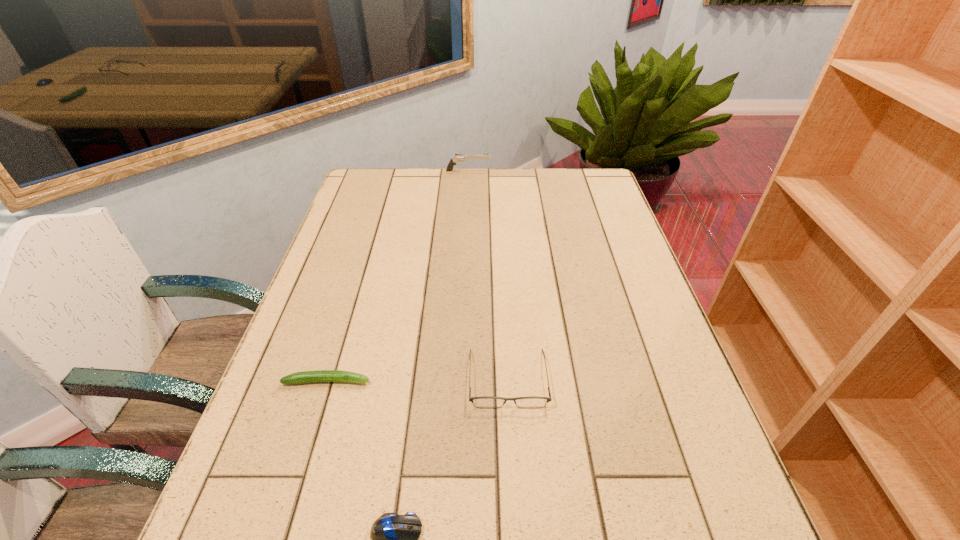
Locate an element on the screen. pistol is located at coordinates (458, 158).

You are a GUI agent. You are given a task and a screenshot of the screen. Output one action in this format:
    pyautogui.click(x=<x>, y=<y>)
    Task: Click on the tallest object
    
    Given the screenshot: What is the action you would take?
    pyautogui.click(x=458, y=158)

The height and width of the screenshot is (540, 960). In order to click on the second tallest object in this screenshot , I will do `click(485, 401)`.

Identify the location of the leftmost object. (320, 375).

Locate an element on the screen. The width and height of the screenshot is (960, 540). vacant area located on the front-facing side of the pistol is located at coordinates (555, 171).

Locate an element on the screen. This screenshot has width=960, height=540. vacant region located on the front-facing side of the spectacles is located at coordinates (511, 436).

In order to click on free point located 0.160m on the front-facing side of the leftmost object in this screenshot , I will do `click(444, 381)`.

Find the location of a particular element. This screenshot has height=540, width=960. object that is positioned at the far edge is located at coordinates (458, 158).

The height and width of the screenshot is (540, 960). Find the location of `object that is at the left edge`. object that is at the left edge is located at coordinates (320, 375).

You are a GUI agent. You are given a task and a screenshot of the screen. Output one action in this format:
    pyautogui.click(x=<x>, y=<y>)
    Task: Click on the vacant space at the far edge
    
    Given the screenshot: What is the action you would take?
    pyautogui.click(x=442, y=187)